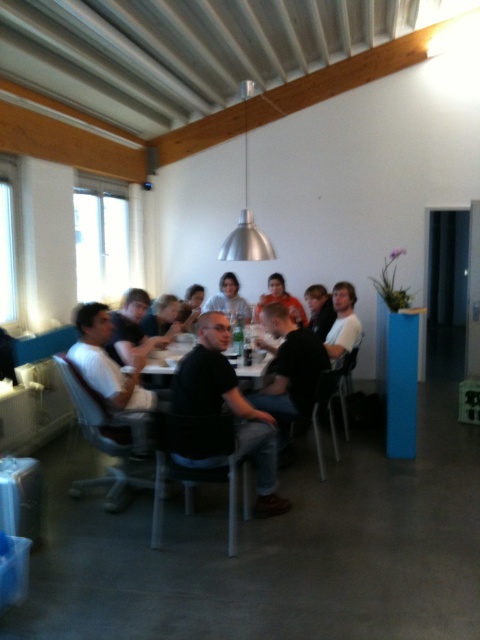
You are standing in the dining area and want to reach both the point at coordinates (282, 426) and the point at coordinates (222, 292). Which point will you reach first if you move straight towards them?

You will reach the point at coordinates (282, 426) first because it is closer to you than the point at coordinates (222, 292).